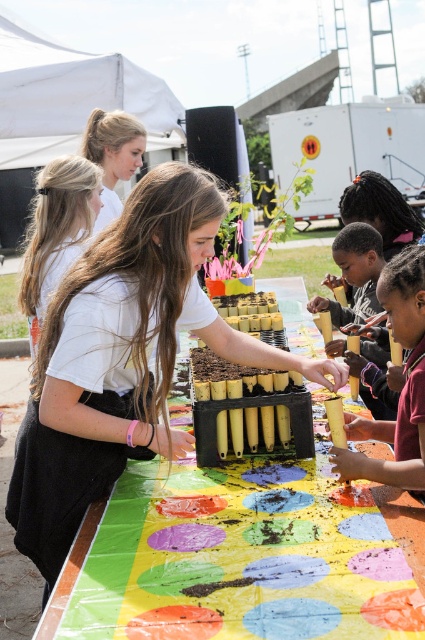
From the picture: Does white matte shirt at center appear on the right side of matte yellow pencil at center?

No, white matte shirt at center is not to the right of matte yellow pencil at center.

Which is more to the left, white matte shirt at center or matte yellow pencil at center?

white matte shirt at center is more to the left.

Which is in front, point (82, 259) or point (393, 444)?

Positioned in front is point (82, 259).

I want to click on white matte shirt at center, so click(122, 358).